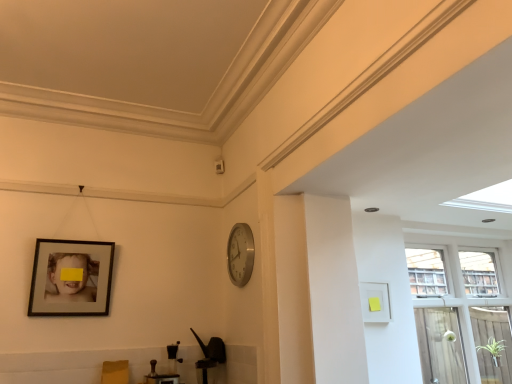
Identify the location of clear glass screen door at right. This screenshot has height=384, width=512. (x=495, y=340).

Where is `transparent glass window at right`? The image size is (512, 384). transparent glass window at right is located at coordinates (460, 312).

Measure the distance between point (369,283) and camera.

Point (369,283) and camera are 2.66 meters apart from each other.

Measure the distance between matte black picture frame at left, the 1th picture frame when ordered from left to right, and camera.

matte black picture frame at left, the 1th picture frame when ordered from left to right, is 2.51 meters away from camera.

The height and width of the screenshot is (384, 512). What are the coordinates of `clear glass screen door at right` in the screenshot? It's located at (495, 340).

In the scene shown: Is clear glass screen door at right with transparent glass window at right?

clear glass screen door at right and transparent glass window at right are clearly separated.

In terms of width, does clear glass screen door at right look wider or thinner when compared to transparent glass window at right?

clear glass screen door at right is thinner than transparent glass window at right.

Which of these two, clear glass screen door at right or transparent glass window at right, stands shorter?

With less height is clear glass screen door at right.

Relative to transparent glass window at right, is clear glass screen door at right in front or behind?

clear glass screen door at right is behind transparent glass window at right.

Looking at this image, is matte black picture frame at left, which is the second picture frame in right-to-left order, situated inside transparent glass window at right or outside?

matte black picture frame at left, which is the second picture frame in right-to-left order, is not enclosed by transparent glass window at right.

From a real-world perspective, which is physically above, matte black picture frame at left, which is the second picture frame in right-to-left order, or transparent glass window at right?

In real-world perspective, matte black picture frame at left, which is the second picture frame in right-to-left order, is above.

Could you tell me if matte black picture frame at left, which is the second picture frame in right-to-left order, is facing transparent glass window at right?

No, matte black picture frame at left, which is the second picture frame in right-to-left order, does not turn towards transparent glass window at right.

Consider the image. Which object is more forward, matte black picture frame at left, which is the second picture frame in right-to-left order, or silver metallic clock at center-right?

matte black picture frame at left, which is the second picture frame in right-to-left order, is more forward.

From the image's perspective, which picture frame is the 1st one below the silver metallic clock at center-right? Please provide its 2D coordinates.

[(71, 278)]

How different are the orientations of matte black picture frame at left, which is the second picture frame in right-to-left order, and silver metallic clock at center-right in degrees?

The facing directions of matte black picture frame at left, which is the second picture frame in right-to-left order, and silver metallic clock at center-right are 90.1 degrees apart.

From a real-world perspective, who is located lower, matte black picture frame at left, the 1th picture frame when ordered from left to right, or silver metallic clock at center-right?

matte black picture frame at left, the 1th picture frame when ordered from left to right, is physically lower.

In the scene shown: Considering the relative positions of transparent glass window at right and white matte picture frame at right, the first picture frame viewed from the right, in the image provided, is transparent glass window at right to the right of white matte picture frame at right, the first picture frame viewed from the right, from the viewer's perspective?

Correct, you'll find transparent glass window at right to the right of white matte picture frame at right, the first picture frame viewed from the right.

Is transparent glass window at right positioned beyond the bounds of white matte picture frame at right, the first picture frame viewed from the right?

That's correct, transparent glass window at right is outside of white matte picture frame at right, the first picture frame viewed from the right.

From a real-world perspective, between transparent glass window at right and white matte picture frame at right, which appears as the 2th picture frame when viewed from the left, who is vertically higher?

In real-world perspective, white matte picture frame at right, which appears as the 2th picture frame when viewed from the left, is above.

In the scene shown: Is the depth of transparent glass window at right greater than that of white matte picture frame at right, the first picture frame viewed from the right?

Yes, the depth of transparent glass window at right is greater than that of white matte picture frame at right, the first picture frame viewed from the right.

In order to click on screen door on the right of white matte picture frame at right, which appears as the 2th picture frame when viewed from the left in this screenshot , I will do `click(495, 340)`.

Is white matte picture frame at right, the first picture frame viewed from the right, positioned with its back to clear glass screen door at right?

That's not correct — white matte picture frame at right, the first picture frame viewed from the right, is not looking away from clear glass screen door at right.

Between white matte picture frame at right, which appears as the 2th picture frame when viewed from the left, and clear glass screen door at right, which one is positioned behind?

Positioned behind is clear glass screen door at right.

How distant is white matte picture frame at right, the first picture frame viewed from the right, from clear glass screen door at right?

They are 4.05 feet apart.

From the image's perspective, is white matte picture frame at right, which appears as the 2th picture frame when viewed from the left, located above or below silver metallic clock at center-right?

Based on their image positions, white matte picture frame at right, which appears as the 2th picture frame when viewed from the left, is located beneath silver metallic clock at center-right.

Which object is thinner, white matte picture frame at right, the first picture frame viewed from the right, or silver metallic clock at center-right?

With smaller width is white matte picture frame at right, the first picture frame viewed from the right.

From the picture: Is silver metallic clock at center-right surrounded by white matte picture frame at right, the first picture frame viewed from the right?

No.

Does point (379, 320) lie behind point (237, 225)?

No, (379, 320) is in front of (237, 225).

How different are the orientations of silver metallic clock at center-right and matte black picture frame at left, which is the second picture frame in right-to-left order, in degrees?

There is a 90.1-degree angle between the facing directions of silver metallic clock at center-right and matte black picture frame at left, which is the second picture frame in right-to-left order.

Is silver metallic clock at center-right bigger than matte black picture frame at left, which is the second picture frame in right-to-left order?

No.

Would you say silver metallic clock at center-right is a long distance from matte black picture frame at left, the 1th picture frame when ordered from left to right?

No, silver metallic clock at center-right is in close proximity to matte black picture frame at left, the 1th picture frame when ordered from left to right.

In the scene shown: Considering the relative sizes of silver metallic clock at center-right and matte black picture frame at left, which is the second picture frame in right-to-left order, in the image provided, is silver metallic clock at center-right shorter than matte black picture frame at left, which is the second picture frame in right-to-left order,?

Yes, silver metallic clock at center-right is shorter than matte black picture frame at left, which is the second picture frame in right-to-left order.

You are a GUI agent. You are given a task and a screenshot of the screen. Output one action in this format:
    pyautogui.click(x=<x>, y=<y>)
    Task: Click on the window on the left of the clear glass screen door at right
    This screenshot has width=512, height=384.
    Given the screenshot: What is the action you would take?
    pyautogui.click(x=460, y=312)

Where is `window below the matte black picture frame at left, which is the second picture frame in right-to-left order (from the image's perspective)`? The width and height of the screenshot is (512, 384). window below the matte black picture frame at left, which is the second picture frame in right-to-left order (from the image's perspective) is located at coordinates (460, 312).

Estimate the real-world distances between objects in this image. Which object is closer to matte black picture frame at left, which is the second picture frame in right-to-left order, silver metallic clock at center-right or white matte picture frame at right, which appears as the 2th picture frame when viewed from the left?

Among the two, silver metallic clock at center-right is located nearer to matte black picture frame at left, which is the second picture frame in right-to-left order.

Estimate the real-world distances between objects in this image. Which object is closer to white matte picture frame at right, which appears as the 2th picture frame when viewed from the left, matte black picture frame at left, which is the second picture frame in right-to-left order, or transparent glass window at right?

The object closer to white matte picture frame at right, which appears as the 2th picture frame when viewed from the left, is transparent glass window at right.

When comparing their distances from clear glass screen door at right, does transparent glass window at right or matte black picture frame at left, the 1th picture frame when ordered from left to right, seem further?

Based on the image, matte black picture frame at left, the 1th picture frame when ordered from left to right, appears to be further to clear glass screen door at right.

Estimate the real-world distances between objects in this image. Which object is closer to transparent glass window at right, white matte picture frame at right, which appears as the 2th picture frame when viewed from the left, or clear glass screen door at right?

clear glass screen door at right.

Looking at the image, which one is located further to clear glass screen door at right, matte black picture frame at left, the 1th picture frame when ordered from left to right, or transparent glass window at right?

matte black picture frame at left, the 1th picture frame when ordered from left to right, is further to clear glass screen door at right.

Considering their positions, is white matte picture frame at right, the first picture frame viewed from the right, positioned further to matte black picture frame at left, which is the second picture frame in right-to-left order, than transparent glass window at right?

Among the two, transparent glass window at right is located further to matte black picture frame at left, which is the second picture frame in right-to-left order.

Based on their spatial positions, is matte black picture frame at left, which is the second picture frame in right-to-left order, or transparent glass window at right further from silver metallic clock at center-right?

transparent glass window at right is further to silver metallic clock at center-right.

From the image, which object appears to be nearer to white matte picture frame at right, the first picture frame viewed from the right, matte black picture frame at left, the 1th picture frame when ordered from left to right, or clear glass screen door at right?

Based on the image, clear glass screen door at right appears to be nearer to white matte picture frame at right, the first picture frame viewed from the right.

Locate an element on the screen. The width and height of the screenshot is (512, 384). clock situated between matte black picture frame at left, the 1th picture frame when ordered from left to right, and clear glass screen door at right from left to right is located at coordinates (240, 254).

Locate an element on the screen. picture frame between silver metallic clock at center-right and clear glass screen door at right from left to right is located at coordinates (375, 302).

The image size is (512, 384). In order to click on window located between silver metallic clock at center-right and clear glass screen door at right in the left-right direction in this screenshot , I will do `click(460, 312)`.

Image resolution: width=512 pixels, height=384 pixels. In order to click on clock between matte black picture frame at left, which is the second picture frame in right-to-left order, and white matte picture frame at right, which appears as the 2th picture frame when viewed from the left, from left to right in this screenshot , I will do `click(240, 254)`.